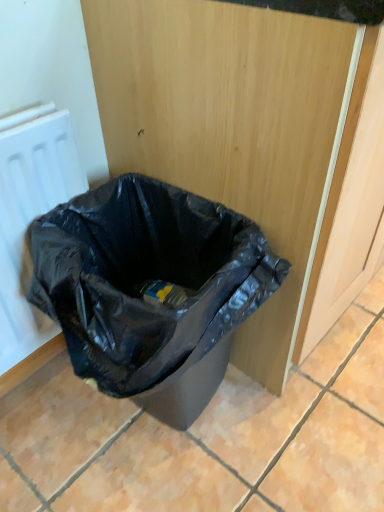
You are a GUI agent. You are given a task and a screenshot of the screen. Output one action in this format:
    pyautogui.click(x=<x>, y=<y>)
    Task: Click on the free area below white matte radiator at left (from a real-world perspective)
    This screenshot has width=384, height=512.
    Given the screenshot: What is the action you would take?
    pyautogui.click(x=38, y=382)